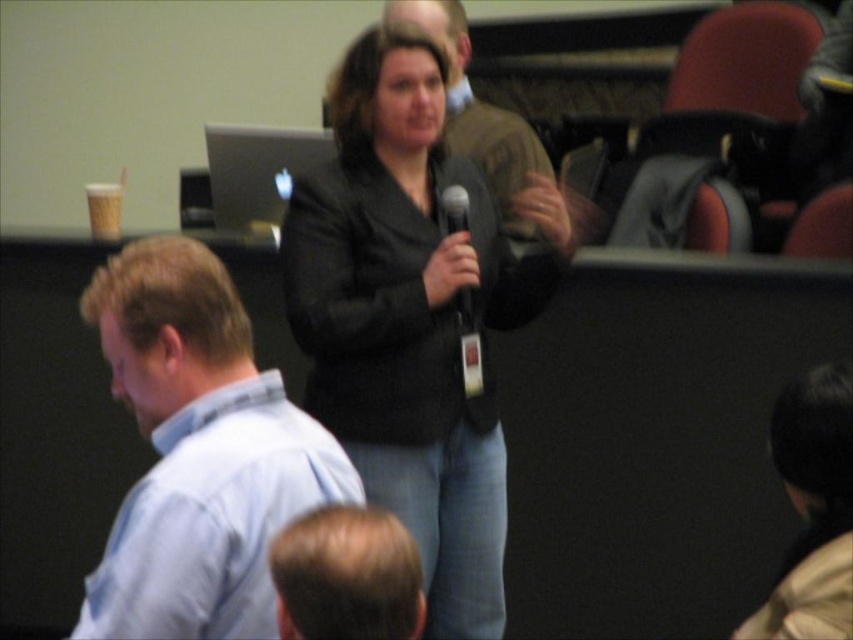
Question: Which object appears closest to the camera in this image?

Choices:
 (A) blonde hair at lower center
 (B) dark brown hair at lower right
 (C) light blue shirt at left
 (D) matte black jacket at center

Answer: (A)

Question: Which object is the farthest from the matte black jacket at center?

Choices:
 (A) blonde hair at lower center
 (B) light blue shirt at left
 (C) black matte microphone at center
 (D) black matte jacket at center

Answer: (A)

Question: Does dark brown hair at lower right appear under black matte microphone at center?

Choices:
 (A) yes
 (B) no

Answer: (A)

Question: Estimate the real-world distances between objects in this image. Which object is farther from the blonde hair at lower center?

Choices:
 (A) black matte microphone at center
 (B) black matte jacket at center
 (C) dark brown hair at lower right
 (D) light blue shirt at left

Answer: (A)

Question: Does black matte jacket at center appear on the left side of blonde hair at lower center?

Choices:
 (A) no
 (B) yes

Answer: (A)

Question: Can you confirm if black matte jacket at center is positioned above black matte microphone at center?

Choices:
 (A) yes
 (B) no

Answer: (B)